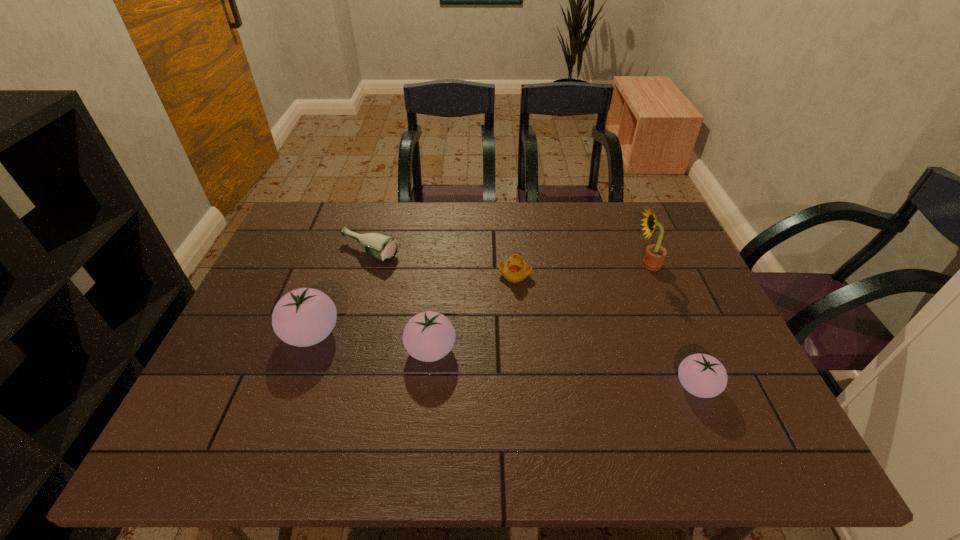
I want to click on tomato at the right edge, so click(702, 375).

Find the location of a particular element. The width and height of the screenshot is (960, 540). sunflower at the right edge is located at coordinates (654, 256).

Locate an element on the screen. object present at the near right corner is located at coordinates (702, 375).

Where is `free space at the far edge of the desktop`? free space at the far edge of the desktop is located at coordinates (549, 239).

Image resolution: width=960 pixels, height=540 pixels. In the image, there is a desktop. Find the location of `vacant space at the near edge`. vacant space at the near edge is located at coordinates (576, 416).

The image size is (960, 540). In the image, there is a desktop. Identify the location of blank space at the left edge. (243, 374).

This screenshot has height=540, width=960. In the image, there is a desktop. Identify the location of vacant space at the right edge. (635, 253).

Locate an element on the screen. The width and height of the screenshot is (960, 540). vacant space at the far left corner of the desktop is located at coordinates (297, 242).

Find the location of a particular element. free space at the near left corner of the desktop is located at coordinates (223, 395).

Image resolution: width=960 pixels, height=540 pixels. Identify the location of free space at the far right corner of the desktop. (632, 218).